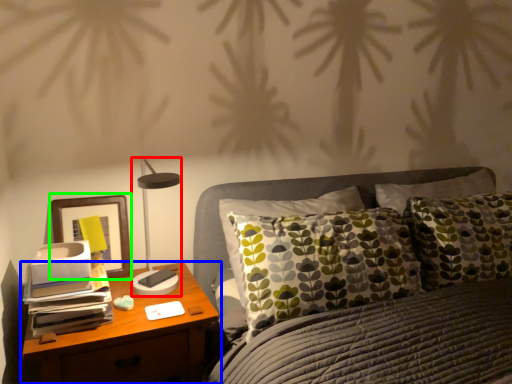
Question: Which object is the closest to the table lamp (highlighted by a red box)? Choose among these: nightstand (highlighted by a blue box) or picture frame (highlighted by a green box).

Choices:
 (A) nightstand
 (B) picture frame

Answer: (B)